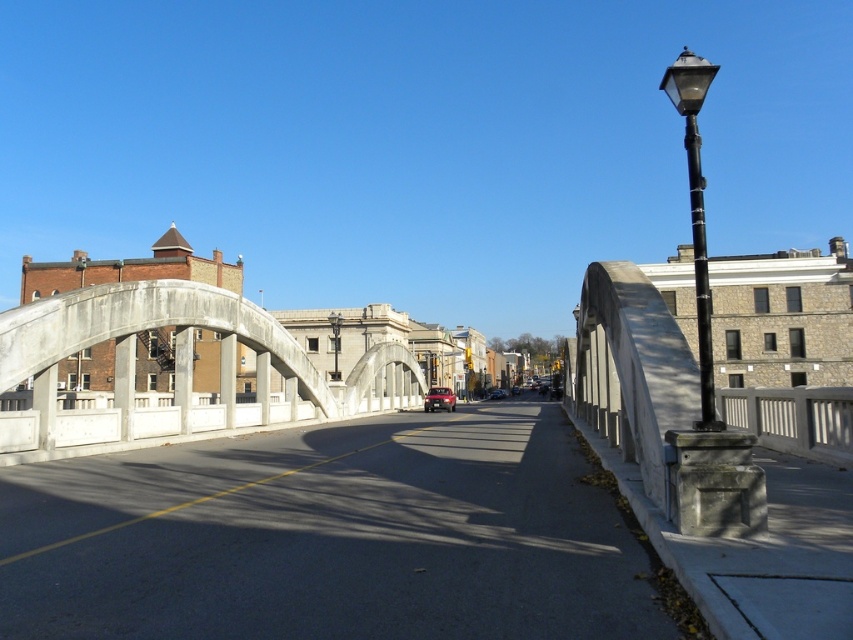
Question: Which of the following is the closest to the observer?

Choices:
 (A) (192, 412)
 (B) (689, 188)
 (C) (498, 392)
 (D) (424, 406)

Answer: (A)

Question: Can you confirm if black metal streetlight at right is thinner than shiny red car at center?

Choices:
 (A) yes
 (B) no

Answer: (B)

Question: Considering the real-world distances, which object is farthest from the black polished metal streetlight at center?

Choices:
 (A) black metal streetlight at right
 (B) matte red car at center

Answer: (A)

Question: Is concrete bridge at center wider than black polished metal streetlight at center?

Choices:
 (A) yes
 (B) no

Answer: (A)

Question: Which of the following is the farthest from the observer?

Choices:
 (A) matte red car at center
 (B) shiny red car at center
 (C) black metal streetlight at right

Answer: (A)

Question: Is black polished metal streetlight at center smaller than matte red car at center?

Choices:
 (A) yes
 (B) no

Answer: (A)